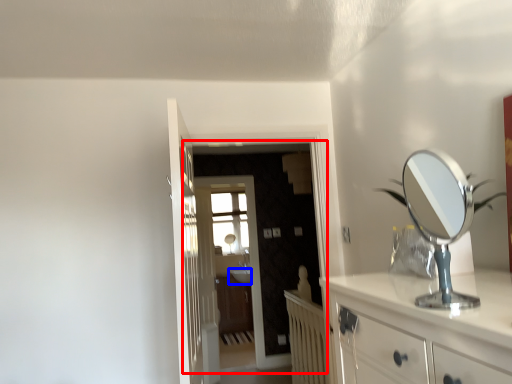
Question: Which point is further to the camera, screen door (highlighted by a red box) or sink (highlighted by a blue box)?

Choices:
 (A) screen door
 (B) sink

Answer: (B)